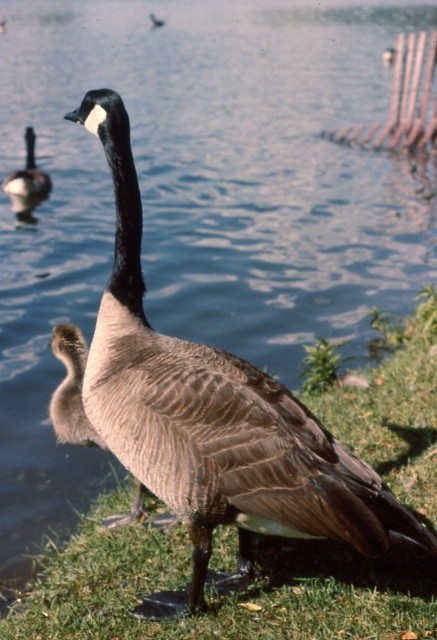
Does point (96, 438) lie in front of point (28, 129)?

Yes, point (96, 438) is closer to viewer.

Does brown feathered goose at center have a larger size compared to brown feathered duckling at upper left?

Incorrect, brown feathered goose at center is not larger than brown feathered duckling at upper left.

Between point (83, 337) and point (31, 170), which one is positioned in front?

Point (83, 337) is in front.

Find the location of a particular element. The width and height of the screenshot is (437, 640). brown feathered goose at center is located at coordinates (70, 388).

Between brown matte duck at center and brown feathered goose at center, which one appears on the right side from the viewer's perspective?

From the viewer's perspective, brown matte duck at center appears more on the right side.

Can you confirm if brown matte duck at center is wider than brown feathered goose at center?

Yes, brown matte duck at center is wider than brown feathered goose at center.

Who is more forward, (72, 113) or (79, 348)?

Point (79, 348) is more forward.

Locate an element on the screen. The height and width of the screenshot is (640, 437). brown matte duck at center is located at coordinates (215, 420).

Between brown matte duck at center and brown feathered duckling at upper left, which one appears on the right side from the viewer's perspective?

brown matte duck at center is more to the right.

Find the location of `brown matte duck at center`. brown matte duck at center is located at coordinates (215, 420).

Is point (194, 346) closer to viewer compared to point (24, 177)?

Yes.

This screenshot has width=437, height=640. I want to click on brown matte duck at center, so click(x=215, y=420).